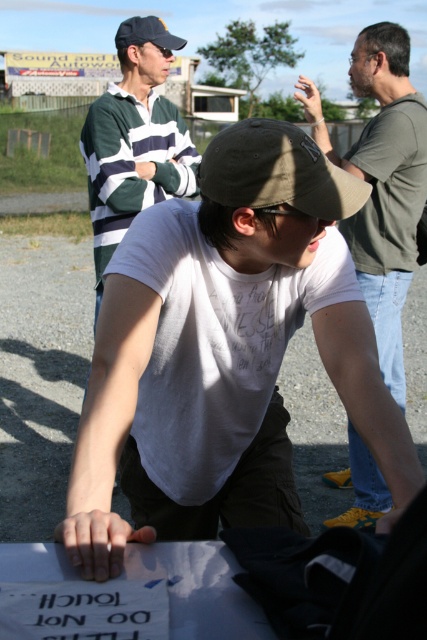
Question: Which point is farther to the camera?

Choices:
 (A) pos(350,86)
 (B) pos(318,172)
 (C) pos(151,20)
 (D) pos(236,522)

Answer: (A)

Question: Which point is farther to the camera?

Choices:
 (A) matte green shirt at upper right
 (B) dark gray fabric baseball cap at upper left
 (C) green striped sweater at upper left
 (D) khaki fabric baseball cap at center

Answer: (B)

Question: Can you confirm if green striped sweater at upper left is positioned to the right of dark gray fabric baseball cap at upper left?

Choices:
 (A) no
 (B) yes

Answer: (B)

Question: Is matte green shirt at upper right in front of khaki fabric baseball cap at center?

Choices:
 (A) no
 (B) yes

Answer: (A)

Question: Which object appears closest to the camera in this image?

Choices:
 (A) matte green shirt at upper right
 (B) khaki fabric baseball cap at center
 (C) green striped sweater at upper left

Answer: (B)

Question: Is the position of matte green shirt at upper right less distant than that of khaki fabric baseball cap at center?

Choices:
 (A) no
 (B) yes

Answer: (A)